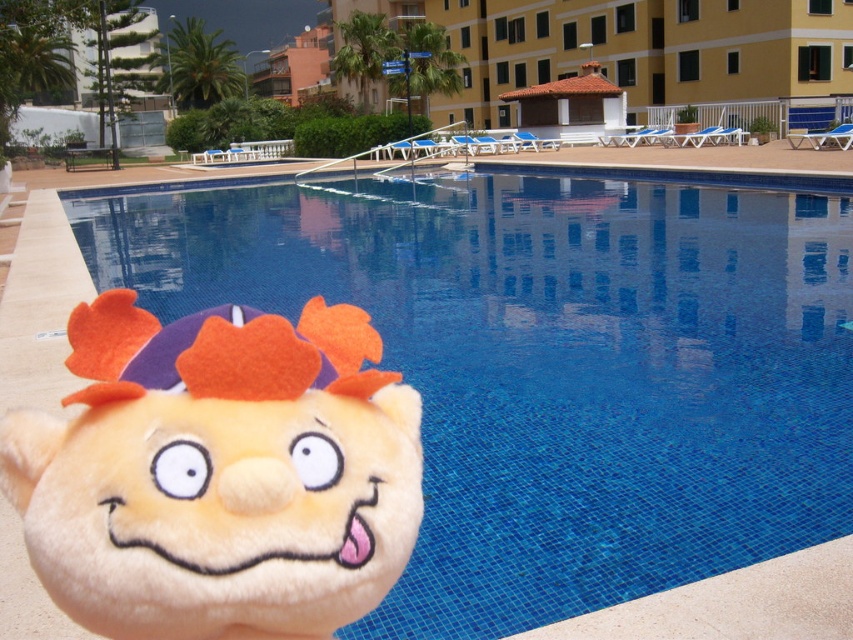
Which of these two, blue mosaic tiles at lower left or fluffy beige plush toy at lower left, stands taller?

blue mosaic tiles at lower left is taller.

Identify the location of blue mosaic tiles at lower left. Image resolution: width=853 pixels, height=640 pixels. (550, 362).

The image size is (853, 640). Identify the location of blue mosaic tiles at lower left. click(550, 362).